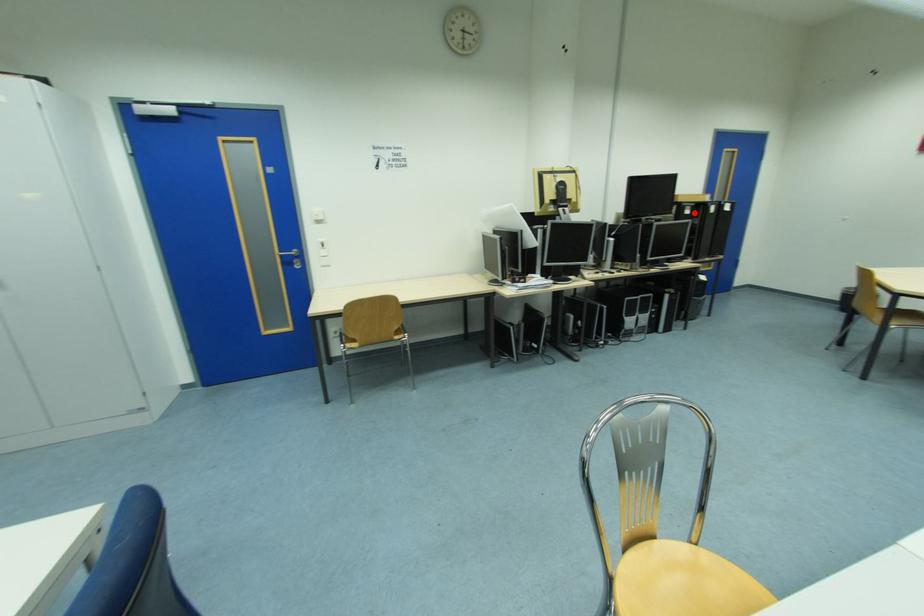
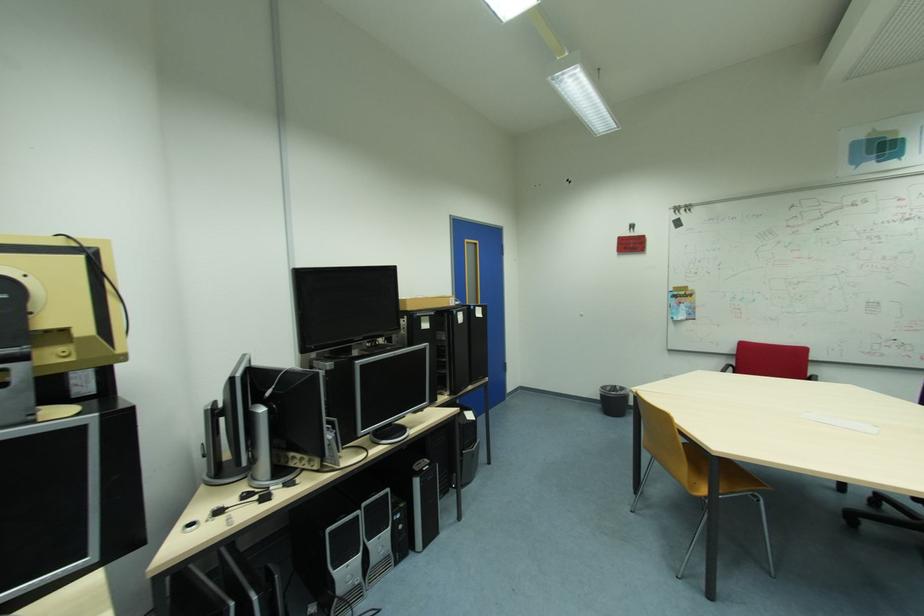
Locate, in the second image, the point that corresponds to the highlighted location in the first image.

(432, 326)